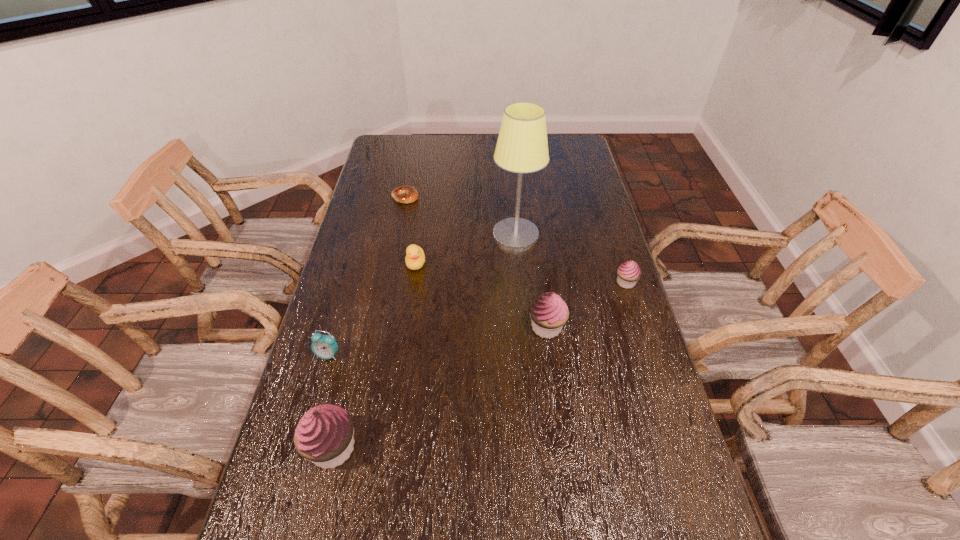
The width and height of the screenshot is (960, 540). What are the coordinates of `the nearest cupcake` in the screenshot? It's located at (324, 435).

Locate an element on the screen. The image size is (960, 540). the leftmost cupcake is located at coordinates (324, 435).

Identify the location of the second cupcake from left to right. The image size is (960, 540). (549, 312).

This screenshot has width=960, height=540. Find the location of `the fifth shortest object`. the fifth shortest object is located at coordinates (549, 312).

This screenshot has height=540, width=960. I want to click on the fourth farthest object, so point(629,272).

In order to click on the rightmost object in this screenshot , I will do `click(629, 272)`.

Where is `bagel`? The image size is (960, 540). bagel is located at coordinates (406, 194).

Identify the location of the shortest object. (406, 194).

Locate an element on the screen. The height and width of the screenshot is (540, 960). the third farthest object is located at coordinates (415, 257).

Find the location of a particular element. The image size is (960, 540). the tallest object is located at coordinates (522, 147).